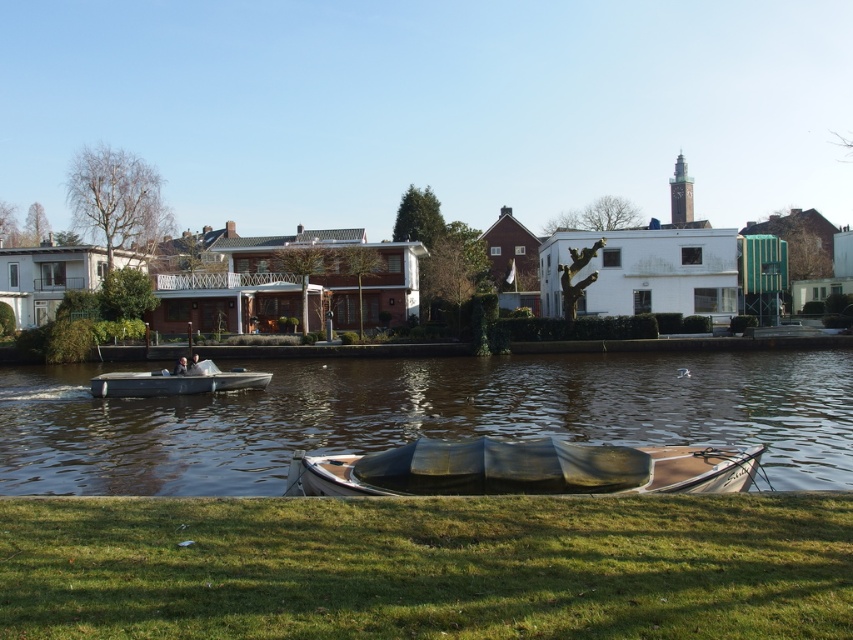
Which is in front, point (630, 400) or point (691, 465)?

Point (691, 465) is in front.

Is smooth brown water at lower center closer to camera compared to wooden boat at center?

No, smooth brown water at lower center is further to the viewer.

Is point (61, 385) closer to camera compared to point (712, 451)?

No, it is behind (712, 451).

You are a GUI agent. You are given a task and a screenshot of the screen. Output one action in this format:
    pyautogui.click(x=<x>, y=<y>)
    Task: Click on the smooth brown water at lower center
    The height and width of the screenshot is (640, 853).
    Given the screenshot: What is the action you would take?
    pyautogui.click(x=421, y=417)

Is point (241, 532) closer to viewer compared to point (331, 362)?

Yes, it is in front of point (331, 362).

Does green grass at lower center appear on the left side of smooth brown water at lower center?

Yes, green grass at lower center is to the left of smooth brown water at lower center.

Image resolution: width=853 pixels, height=640 pixels. What do you see at coordinates (427, 566) in the screenshot?
I see `green grass at lower center` at bounding box center [427, 566].

Find the location of a particular element. The width and height of the screenshot is (853, 640). green grass at lower center is located at coordinates (427, 566).

Which is in front, point (167, 522) or point (119, 387)?

Point (167, 522) is in front.

Does point (524, 572) lie in front of point (189, 365)?

Yes, it is in front of point (189, 365).

Image resolution: width=853 pixels, height=640 pixels. Identify the location of green grass at lower center. (427, 566).